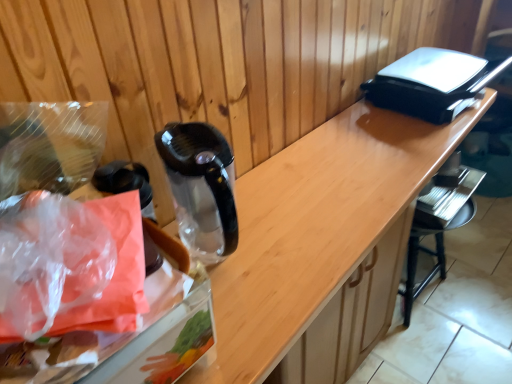
Question: Is point (250, 183) positioned closer to the camera than point (99, 177)?

Choices:
 (A) closer
 (B) farther

Answer: (B)

Question: Is wooden counter at center situated inside transparent plastic bag at left or outside?

Choices:
 (A) outside
 (B) inside

Answer: (A)

Question: Which object is the farthest from the transparent plastic bag at left?

Choices:
 (A) wooden counter at center
 (B) translucent plastic bag at left
 (C) black plastic bar stool at lower right

Answer: (C)

Question: Considering the real-world distances, which object is closest to the black plastic bar stool at lower right?

Choices:
 (A) translucent plastic bag at left
 (B) transparent plastic bag at left
 (C) wooden counter at center

Answer: (C)